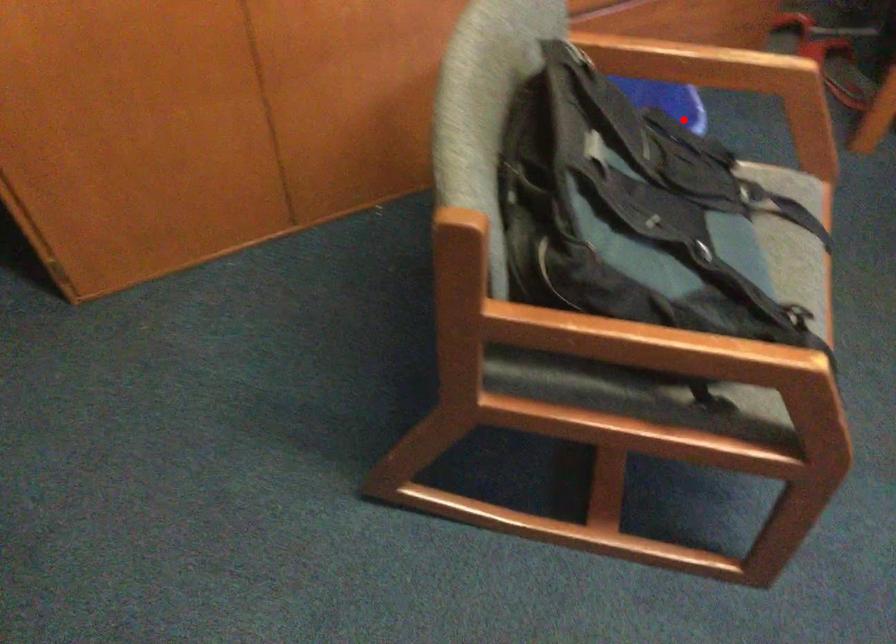
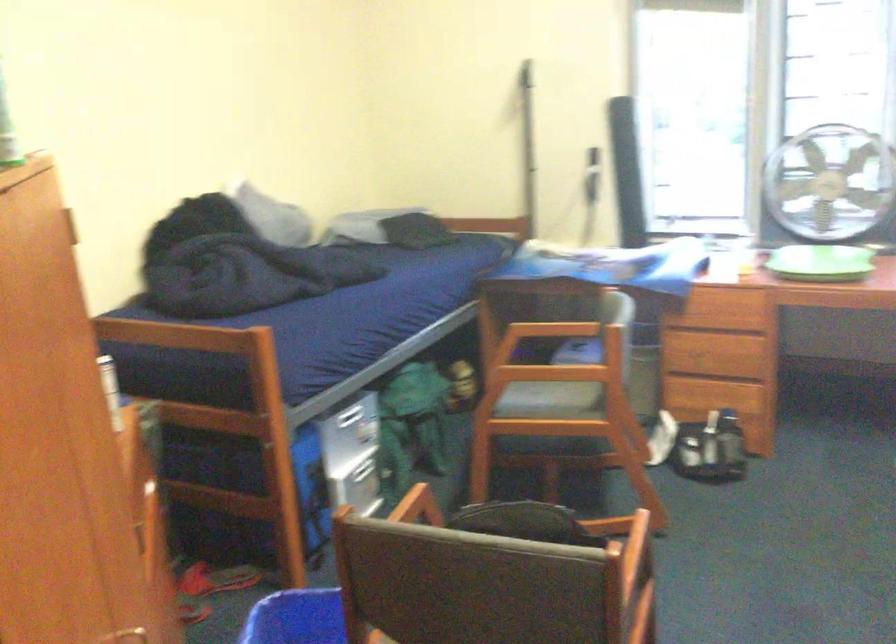
Question: I am providing you with two images of the same scene from different viewpoints. In image1, a red point is highlighted. Considering the same 3D point in image2, which of the following is correct?

Choices:
 (A) It is closer
 (B) It is farther

Answer: (B)